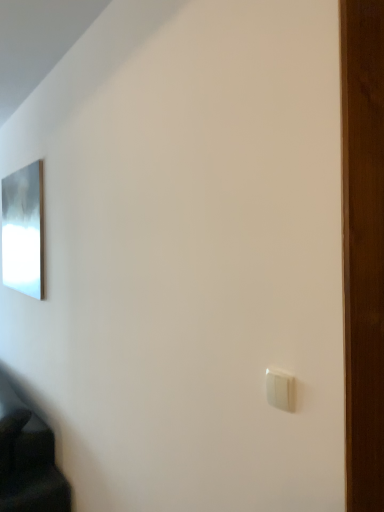
At what (x,y) coordinates should I click in order to perform the action: click on white plastic light switch at lower right. Please return your answer as a coordinate pair (x, y). Looking at the image, I should click on (280, 390).

Image resolution: width=384 pixels, height=512 pixels. What do you see at coordinates (280, 390) in the screenshot?
I see `white plastic light switch at lower right` at bounding box center [280, 390].

What are the coordinates of `white plastic light switch at lower right` in the screenshot? It's located at (280, 390).